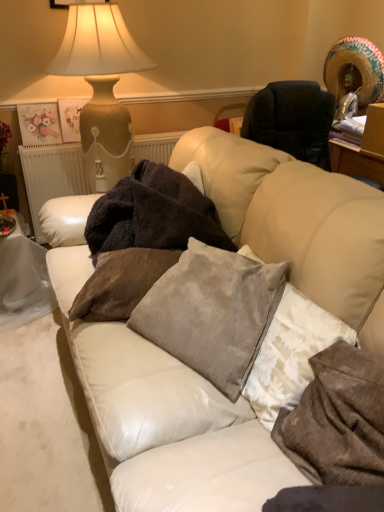
Describe the element at coordinates (153, 214) in the screenshot. I see `dark brown plush blanket at center` at that location.

This screenshot has width=384, height=512. What are the coordinates of `multicolored woven straw hat at upper right` in the screenshot? It's located at (355, 70).

From a real-world perspective, is white textured pillow at lower right, the first pillow positioned from the right, on multicolored woven straw hat at upper right?

No, from a real-world perspective, white textured pillow at lower right, the first pillow positioned from the right, is not over multicolored woven straw hat at upper right

Who is shorter, white textured pillow at lower right, marked as the 3th pillow in a left-to-right arrangement, or multicolored woven straw hat at upper right?

white textured pillow at lower right, marked as the 3th pillow in a left-to-right arrangement.

At what (x,y) coordinates should I click in order to perform the action: click on straw hat behind the white textured pillow at lower right, marked as the 3th pillow in a left-to-right arrangement. Please return your answer as a coordinate pair (x, y). The width and height of the screenshot is (384, 512). Looking at the image, I should click on (355, 70).

Is point (316, 452) closer or farther from the camera than point (373, 51)?

Clearly, point (316, 452) is closer to the camera than point (373, 51).

From the image's perspective, which one is positioned lower, multicolored woven straw hat at upper right or velvet brown pillow at center, the first pillow positioned from the left?

velvet brown pillow at center, the first pillow positioned from the left, from the image's perspective.

Would you say multicolored woven straw hat at upper right contains velvet brown pillow at center, the first pillow positioned from the left?

No, velvet brown pillow at center, the first pillow positioned from the left, is not a part of multicolored woven straw hat at upper right.

Does multicolored woven straw hat at upper right come behind velvet brown pillow at center, the first pillow positioned from the left?

That is True.

From a real-world perspective, is multicolored woven straw hat at upper right positioned under velvet brown pillow at center, the third pillow from the right, based on gravity?

Incorrect, from a real-world perspective, multicolored woven straw hat at upper right is higher than velvet brown pillow at center, the third pillow from the right.

Is velvet gray pillow at center, marked as the 2th pillow in a left-to-right arrangement, completely or partially inside white textured pillow at lower right, the first pillow positioned from the right?

No, velvet gray pillow at center, marked as the 2th pillow in a left-to-right arrangement, is located outside of white textured pillow at lower right, the first pillow positioned from the right.

In terms of size, does white textured pillow at lower right, marked as the 3th pillow in a left-to-right arrangement, appear bigger or smaller than velvet gray pillow at center, marked as the 2th pillow in a left-to-right arrangement?

Clearly, white textured pillow at lower right, marked as the 3th pillow in a left-to-right arrangement, is smaller in size than velvet gray pillow at center, marked as the 2th pillow in a left-to-right arrangement.

Is white textured pillow at lower right, the first pillow positioned from the right, positioned before velvet gray pillow at center, marked as the 2th pillow in a left-to-right arrangement?

Yes.

In order to click on the 1st pillow behind the white textured pillow at lower right, marked as the 3th pillow in a left-to-right arrangement in this screenshot , I will do `click(212, 312)`.

Considering the relative sizes of wooden picture frame at upper center and multicolored woven straw hat at upper right in the image provided, is wooden picture frame at upper center bigger than multicolored woven straw hat at upper right?

No, wooden picture frame at upper center is not bigger than multicolored woven straw hat at upper right.

Locate an element on the screen. straw hat behind the wooden picture frame at upper center is located at coordinates (355, 70).

Is wooden picture frame at upper center facing away from multicolored woven straw hat at upper right?

No.

How much distance is there between wooden picture frame at upper center and multicolored woven straw hat at upper right?

They are 5.05 feet apart.

Which object is closer to the camera, dark brown plush blanket at center or velvet gray pillow at center, marked as the 2th pillow in a left-to-right arrangement?

velvet gray pillow at center, marked as the 2th pillow in a left-to-right arrangement, is more forward.

Is dark brown plush blanket at center facing away from velvet gray pillow at center, marked as the 2th pillow in a left-to-right arrangement?

No, dark brown plush blanket at center's orientation is not away from velvet gray pillow at center, marked as the 2th pillow in a left-to-right arrangement.

Which is less distant, (174, 229) or (271, 301)?

The point (271, 301) is in front.

Between dark brown plush blanket at center and velvet gray pillow at center, arranged as the second pillow when viewed from the right, which one has smaller width?

velvet gray pillow at center, arranged as the second pillow when viewed from the right.

From the image's perspective, between matte beige ceramic table lamp at upper left and velvet gray pillow at center, marked as the 2th pillow in a left-to-right arrangement, who is located below?

From the image's view, velvet gray pillow at center, marked as the 2th pillow in a left-to-right arrangement, is below.

Is point (86, 47) behind point (172, 344)?

Yes, point (86, 47) is behind point (172, 344).

From a real-world perspective, which object stands above the other?

From a 3D spatial view, matte beige ceramic table lamp at upper left is above.

Does matte beige ceramic table lamp at upper left contain velvet gray pillow at center, arranged as the second pillow when viewed from the right?

Definitely not — velvet gray pillow at center, arranged as the second pillow when viewed from the right, is not inside matte beige ceramic table lamp at upper left.

Does velvet brown pillow at center, the first pillow positioned from the left, appear on the left side of multicolored woven straw hat at upper right?

Correct, you'll find velvet brown pillow at center, the first pillow positioned from the left, to the left of multicolored woven straw hat at upper right.

Is velvet brown pillow at center, the third pillow from the right, positioned beyond the bounds of multicolored woven straw hat at upper right?

Yes.

Is velvet brown pillow at center, the third pillow from the right, smaller than multicolored woven straw hat at upper right?

Indeed, velvet brown pillow at center, the third pillow from the right, has a smaller size compared to multicolored woven straw hat at upper right.

This screenshot has width=384, height=512. I want to click on straw hat to the right of white textured pillow at lower right, marked as the 3th pillow in a left-to-right arrangement, so click(355, 70).

Where is `straw hat above the velvet brown pillow at center, the third pillow from the right (from a real-world perspective)`? Image resolution: width=384 pixels, height=512 pixels. straw hat above the velvet brown pillow at center, the third pillow from the right (from a real-world perspective) is located at coordinates (355, 70).

From the image, which object appears to be farther from wooden picture frame at upper center, multicolored woven straw hat at upper right or white textured pillow at lower right, marked as the 3th pillow in a left-to-right arrangement?

white textured pillow at lower right, marked as the 3th pillow in a left-to-right arrangement, is positioned further to the anchor wooden picture frame at upper center.

Estimate the real-world distances between objects in this image. Which object is closer to velvet brown pillow at center, the third pillow from the right, white textured pillow at lower right, marked as the 3th pillow in a left-to-right arrangement, or dark brown plush blanket at center?

Among the two, dark brown plush blanket at center is located nearer to velvet brown pillow at center, the third pillow from the right.

Considering their positions, is white textured pillow at lower right, the first pillow positioned from the right, positioned closer to velvet brown pillow at center, the first pillow positioned from the left, than wooden picture frame at upper center?

white textured pillow at lower right, the first pillow positioned from the right, is closer to velvet brown pillow at center, the first pillow positioned from the left.

Which object lies further to the anchor point wooden picture frame at upper center, white textured pillow at lower right, the first pillow positioned from the right, or velvet gray pillow at center, marked as the 2th pillow in a left-to-right arrangement?

white textured pillow at lower right, the first pillow positioned from the right, lies further to wooden picture frame at upper center than the other object.

From the image, which object appears to be nearer to wooden picture frame at upper center, velvet brown pillow at center, the first pillow positioned from the left, or dark brown plush blanket at center?

dark brown plush blanket at center lies closer to wooden picture frame at upper center than the other object.

Looking at the image, which one is located further to matte beige ceramic table lamp at upper left, velvet gray pillow at center, arranged as the second pillow when viewed from the right, or velvet brown pillow at center, the third pillow from the right?

velvet gray pillow at center, arranged as the second pillow when viewed from the right, is further to matte beige ceramic table lamp at upper left.

Estimate the real-world distances between objects in this image. Which object is further from multicolored woven straw hat at upper right, wooden picture frame at upper center or matte beige ceramic table lamp at upper left?

wooden picture frame at upper center is further to multicolored woven straw hat at upper right.

Which object lies further to the anchor point velvet gray pillow at center, marked as the 2th pillow in a left-to-right arrangement, dark brown plush blanket at center or multicolored woven straw hat at upper right?

The object further to velvet gray pillow at center, marked as the 2th pillow in a left-to-right arrangement, is multicolored woven straw hat at upper right.

I want to click on blanket between white textured pillow at lower right, marked as the 3th pillow in a left-to-right arrangement, and multicolored woven straw hat at upper right in the front-back direction, so click(153, 214).

Locate an element on the screen. Image resolution: width=384 pixels, height=512 pixels. straw hat that lies between wooden picture frame at upper center and velvet gray pillow at center, arranged as the second pillow when viewed from the right, from top to bottom is located at coordinates (355, 70).

Find the location of `table lamp between wooden picture frame at upper center and multicolored woven straw hat at upper right in the horizontal direction`. table lamp between wooden picture frame at upper center and multicolored woven straw hat at upper right in the horizontal direction is located at coordinates (101, 87).

At what (x,y) coordinates should I click in order to perform the action: click on pillow between matte beige ceramic table lamp at upper left and velvet gray pillow at center, marked as the 2th pillow in a left-to-right arrangement, in the vertical direction. Please return your answer as a coordinate pair (x, y). Looking at the image, I should click on (120, 283).